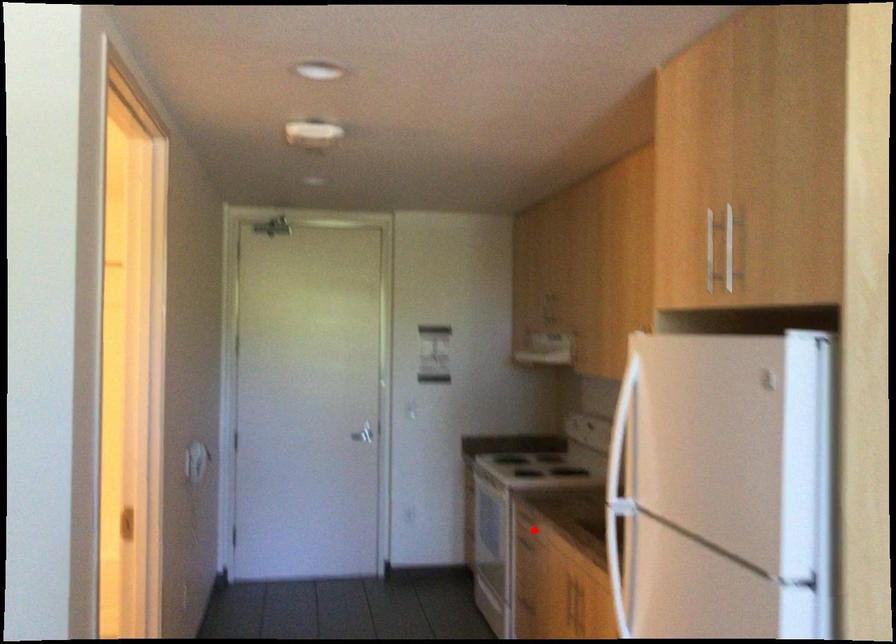
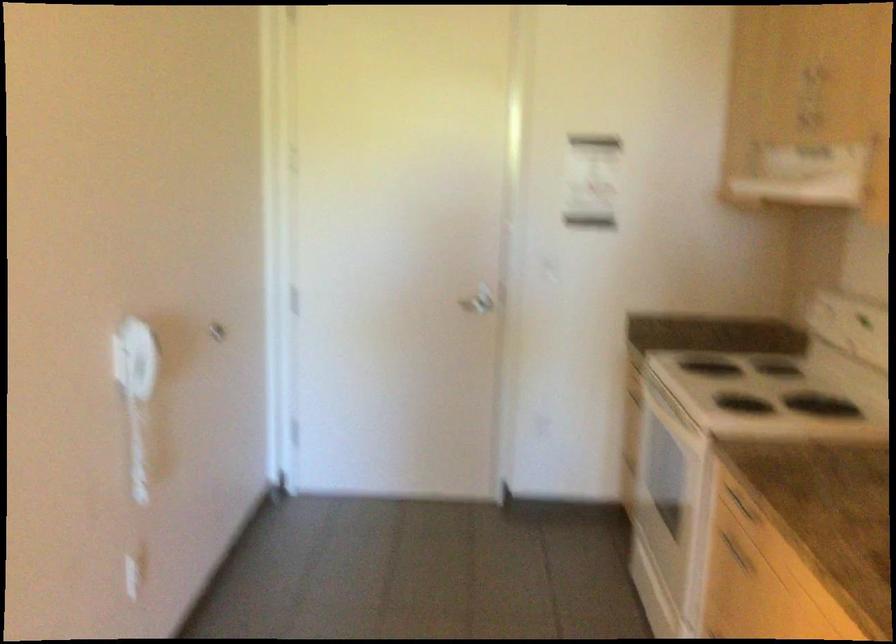
Question: I am providing you with two images of the same scene from different viewpoints. Image1 has a red point marked. In image2, the corresponding 3D location appears at what relative position? Reply with the corresponding letter.

Choices:
 (A) Closer
 (B) Farther

Answer: (A)